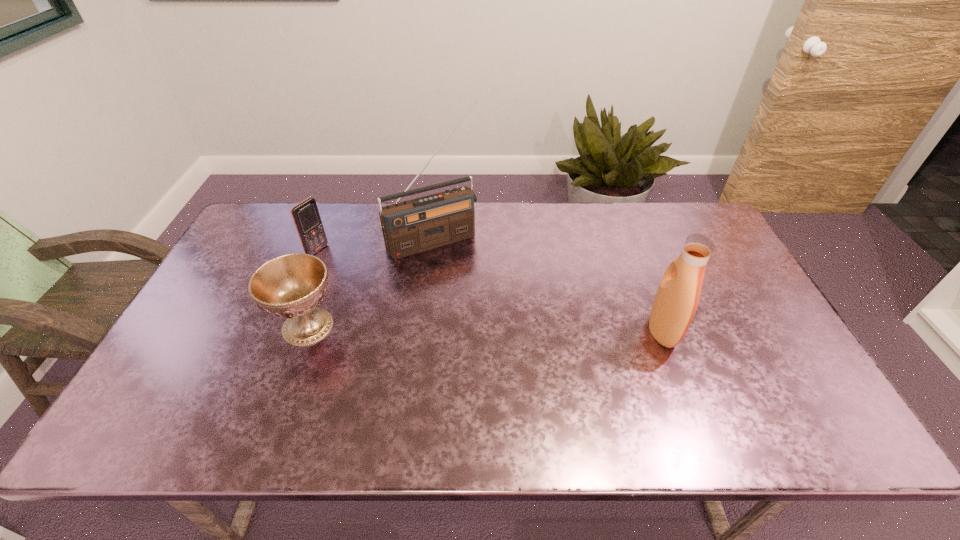
This screenshot has width=960, height=540. Find the location of `chalice`. chalice is located at coordinates (291, 285).

This screenshot has width=960, height=540. Identify the location of the third shortest object. click(677, 297).

Where is `the rightmost object`? The height and width of the screenshot is (540, 960). the rightmost object is located at coordinates (677, 297).

Find the location of a particular element. The height and width of the screenshot is (540, 960). radio receiver is located at coordinates (409, 227).

You are a GUI agent. You are given a task and a screenshot of the screen. Output one action in this format:
    pyautogui.click(x=<x>, y=<y>)
    Task: Click on the tallest object
    
    Given the screenshot: What is the action you would take?
    pyautogui.click(x=409, y=227)

Locate an element on the screen. cellular telephone is located at coordinates (306, 216).

At what (x,y) coordinates should I click in order to perform the action: click on free space located 0.280m on the right of the chalice. Please return your answer as a coordinate pair (x, y). Image resolution: width=960 pixels, height=540 pixels. Looking at the image, I should click on (445, 327).

You are a GUI agent. You are given a task and a screenshot of the screen. Output one action in this format:
    pyautogui.click(x=<x>, y=<y>)
    Task: Click on the blank area located on the front-facing side of the second tallest object
    
    Given the screenshot: What is the action you would take?
    pyautogui.click(x=764, y=331)

At what (x,y) coordinates should I click in order to perform the action: click on vacant space located on the front-facing side of the radio receiver. Please return your answer as a coordinate pair (x, y). The height and width of the screenshot is (540, 960). Looking at the image, I should click on (489, 319).

I want to click on vacant space located on the front-facing side of the radio receiver, so click(x=488, y=316).